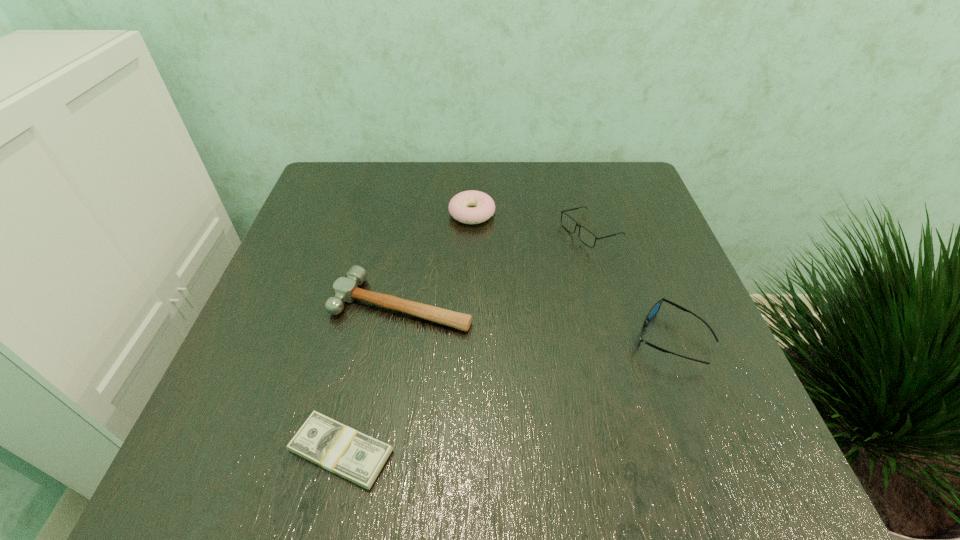
Find the location of a particular element. This screenshot has width=960, height=540. free space that is in between the hammer and the sunglasses is located at coordinates (537, 321).

Select which object is the third closest to the hammer. Please provide its 2D coordinates. Your answer should be formatted as a tuple, i.e. [(x, y)], where the tuple contains the x and y coordinates of a point satisfying the conditions above.

[(586, 236)]

This screenshot has height=540, width=960. Identify the location of object that is the second closest to the doughnut. tap(345, 289).